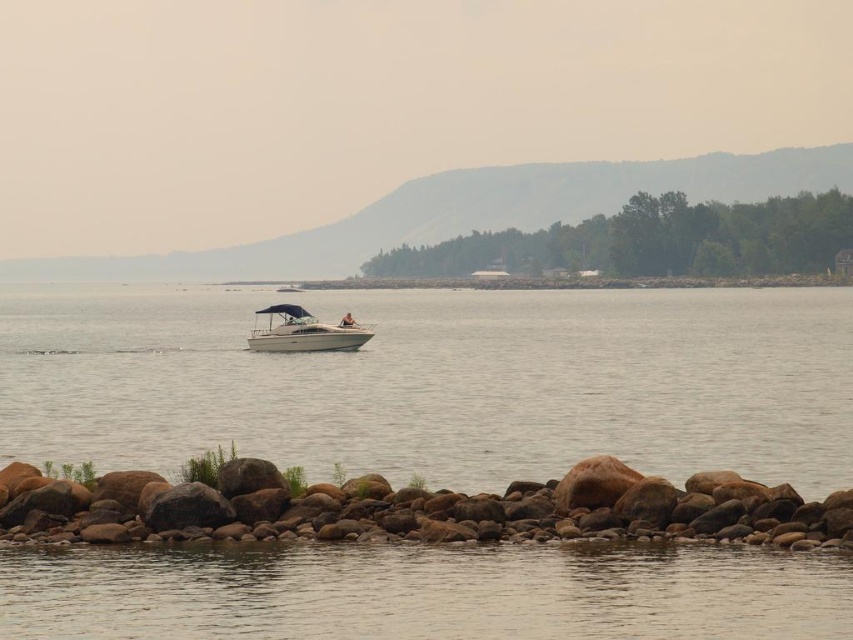
Which is behind, point (399, 332) or point (346, 348)?

Point (399, 332)

Where is `clear water at center`? The height and width of the screenshot is (640, 853). clear water at center is located at coordinates (440, 384).

Is clear water at center to the right of brown rock at lower center from the viewer's perspective?

Yes, clear water at center is to the right of brown rock at lower center.

Can you confirm if clear water at center is taller than brown rock at lower center?

Yes, clear water at center is taller than brown rock at lower center.

Who is more forward, (x=184, y=420) or (x=590, y=538)?

Point (x=590, y=538) is more forward.

Image resolution: width=853 pixels, height=640 pixels. I want to click on clear water at center, so click(440, 384).

I want to click on brown rock at lower center, so click(424, 509).

Who is positioned more to the right, brown rock at lower center or white glossy boat at center?

From the viewer's perspective, brown rock at lower center appears more on the right side.

What do you see at coordinates (424, 509) in the screenshot?
I see `brown rock at lower center` at bounding box center [424, 509].

Identify the location of brown rock at lower center. This screenshot has height=640, width=853. (424, 509).